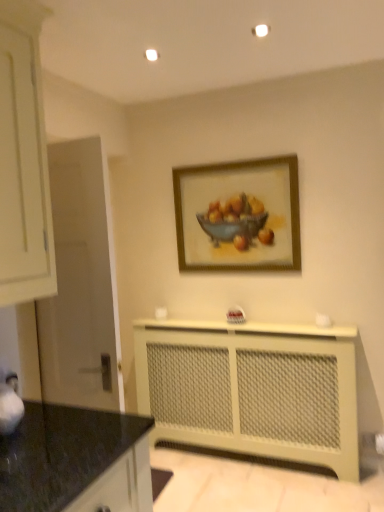
Question: Considering the relative sizes of black granite countertop at lower left and beige mesh radiator at lower center in the image provided, is black granite countertop at lower left shorter than beige mesh radiator at lower center?

Choices:
 (A) yes
 (B) no

Answer: (A)

Question: Can you confirm if black granite countertop at lower left is smaller than beige mesh radiator at lower center?

Choices:
 (A) no
 (B) yes

Answer: (B)

Question: Is black granite countertop at lower left not close to beige mesh radiator at lower center?

Choices:
 (A) yes
 (B) no

Answer: (A)

Question: Considering the relative sizes of black granite countertop at lower left and beige mesh radiator at lower center in the image provided, is black granite countertop at lower left taller than beige mesh radiator at lower center?

Choices:
 (A) yes
 (B) no

Answer: (B)

Question: From the image's perspective, would you say black granite countertop at lower left is positioned over beige mesh radiator at lower center?

Choices:
 (A) yes
 (B) no

Answer: (A)

Question: Is black granite countertop at lower left at the left side of beige mesh radiator at lower center?

Choices:
 (A) no
 (B) yes

Answer: (B)

Question: Does wooden frame at upper center have a greater width compared to beige mesh radiator at lower center?

Choices:
 (A) yes
 (B) no

Answer: (B)

Question: Is wooden frame at upper center smaller than beige mesh radiator at lower center?

Choices:
 (A) yes
 (B) no

Answer: (A)

Question: Can you confirm if wooden frame at upper center is taller than beige mesh radiator at lower center?

Choices:
 (A) no
 (B) yes

Answer: (A)

Question: From the image's perspective, does wooden frame at upper center appear lower than beige mesh radiator at lower center?

Choices:
 (A) yes
 (B) no

Answer: (B)

Question: Is wooden frame at upper center shorter than beige mesh radiator at lower center?

Choices:
 (A) yes
 (B) no

Answer: (A)

Question: From the image's perspective, does wooden frame at upper center appear higher than beige mesh radiator at lower center?

Choices:
 (A) yes
 (B) no

Answer: (A)

Question: Is wooden frame at upper center to the left of black granite countertop at lower left from the viewer's perspective?

Choices:
 (A) no
 (B) yes

Answer: (A)